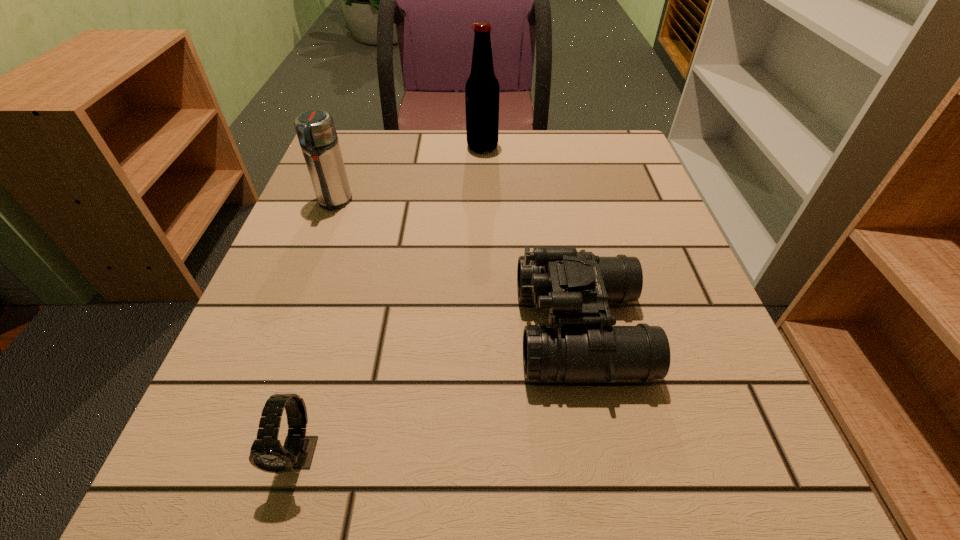
Locate an element on the screen. This screenshot has height=540, width=960. the farthest object is located at coordinates (482, 88).

Where is `the tallest object`? the tallest object is located at coordinates (482, 88).

Locate an element on the screen. The width and height of the screenshot is (960, 540). the third nearest object is located at coordinates (315, 129).

You are a GUI agent. You are given a task and a screenshot of the screen. Output one action in this format:
    pyautogui.click(x=<x>, y=<y>)
    Task: Click on the third shortest object
    
    Given the screenshot: What is the action you would take?
    pyautogui.click(x=315, y=129)

Where is `the second nearest object`? This screenshot has width=960, height=540. the second nearest object is located at coordinates (580, 344).

Find the location of a particular element. The image size is (960, 540). the third tallest object is located at coordinates (580, 344).

Image resolution: width=960 pixels, height=540 pixels. In order to click on the shortest object in this screenshot , I will do `click(267, 454)`.

What are the coordinates of `watch` in the screenshot? It's located at (267, 454).

Where is `blank area located on the left of the second object from right to left`? blank area located on the left of the second object from right to left is located at coordinates (352, 147).

You are a GUI agent. You are given a task and a screenshot of the screen. Output one action in this format:
    pyautogui.click(x=<x>, y=<y>)
    Task: Click on the free point located with a handle on the side of the thermos bottle
    The image size is (960, 540).
    Given the screenshot: What is the action you would take?
    pyautogui.click(x=271, y=368)